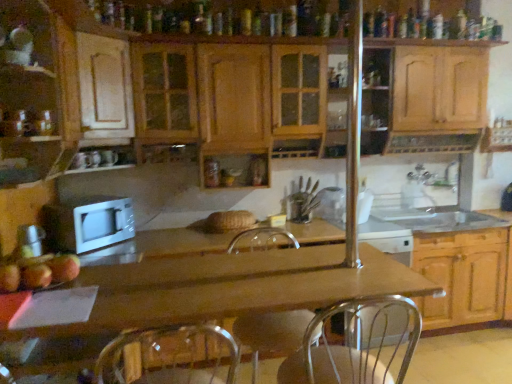
Question: Considering the relative sizes of silver metallic faucet at upper right, positioned as the second faucet in left-to-right order, and wooden cabinets at center, acting as the second cabinetry starting from the left, in the image provided, is silver metallic faucet at upper right, positioned as the second faucet in left-to-right order, smaller than wooden cabinets at center, acting as the second cabinetry starting from the left,?

Choices:
 (A) no
 (B) yes

Answer: (B)

Question: From the image's perspective, is silver metallic faucet at upper right, arranged as the first faucet when viewed from the right, located above wooden cabinets at center, acting as the second cabinetry starting from the right?

Choices:
 (A) yes
 (B) no

Answer: (B)

Question: From a real-world perspective, is silver metallic faucet at upper right, arranged as the first faucet when viewed from the right, on top of wooden cabinets at center, acting as the second cabinetry starting from the right?

Choices:
 (A) no
 (B) yes

Answer: (A)

Question: Can you confirm if silver metallic faucet at upper right, arranged as the first faucet when viewed from the right, is bigger than wooden cabinets at center, acting as the second cabinetry starting from the left?

Choices:
 (A) yes
 (B) no

Answer: (B)

Question: Is silver metallic faucet at upper right, positioned as the second faucet in left-to-right order, oriented towards wooden cabinets at center, acting as the second cabinetry starting from the right?

Choices:
 (A) no
 (B) yes

Answer: (B)

Question: Does silver metallic faucet at upper right, positioned as the second faucet in left-to-right order, come in front of wooden cabinets at center, acting as the second cabinetry starting from the left?

Choices:
 (A) yes
 (B) no

Answer: (B)

Question: Is clear glass jar at center at the right side of white glossy sink at right?

Choices:
 (A) no
 (B) yes

Answer: (A)

Question: From the image's perspective, is clear glass jar at center beneath white glossy sink at right?

Choices:
 (A) yes
 (B) no

Answer: (B)

Question: Can you confirm if clear glass jar at center is smaller than white glossy sink at right?

Choices:
 (A) yes
 (B) no

Answer: (A)

Question: Is the depth of clear glass jar at center less than that of white glossy sink at right?

Choices:
 (A) yes
 (B) no

Answer: (B)

Question: Is clear glass jar at center turned away from white glossy sink at right?

Choices:
 (A) yes
 (B) no

Answer: (B)

Question: Is clear glass jar at center thinner than white glossy sink at right?

Choices:
 (A) no
 (B) yes

Answer: (B)

Question: Would you say metallic silver swivel chair at center is a long distance from silver metallic faucet at upper right, positioned as the second faucet in left-to-right order?

Choices:
 (A) yes
 (B) no

Answer: (A)